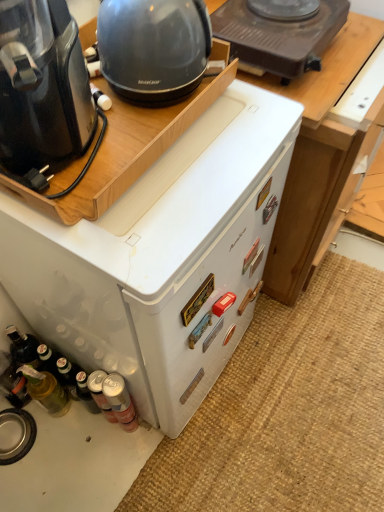
Where is `free point to the right of metallic silver can at lower left, the 3th bottle viewed from the left`? free point to the right of metallic silver can at lower left, the 3th bottle viewed from the left is located at coordinates (188, 443).